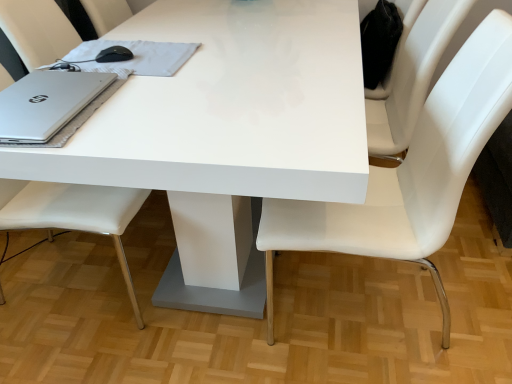
At what (x,y) coordinates should I click in order to perform the action: click on free space to the back side of satin silver notebook at upper left. Please return your answer as a coordinate pair (x, y). The width and height of the screenshot is (512, 384). Looking at the image, I should click on (169, 31).